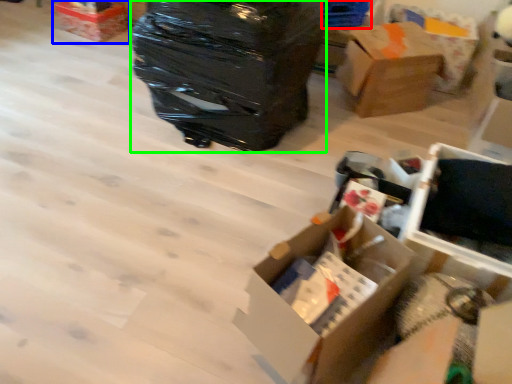
Question: Which object is the closest to the storage box (highlighted by a red box)? Choose among these: box (highlighted by a blue box) or garbage (highlighted by a green box).

Choices:
 (A) box
 (B) garbage

Answer: (B)